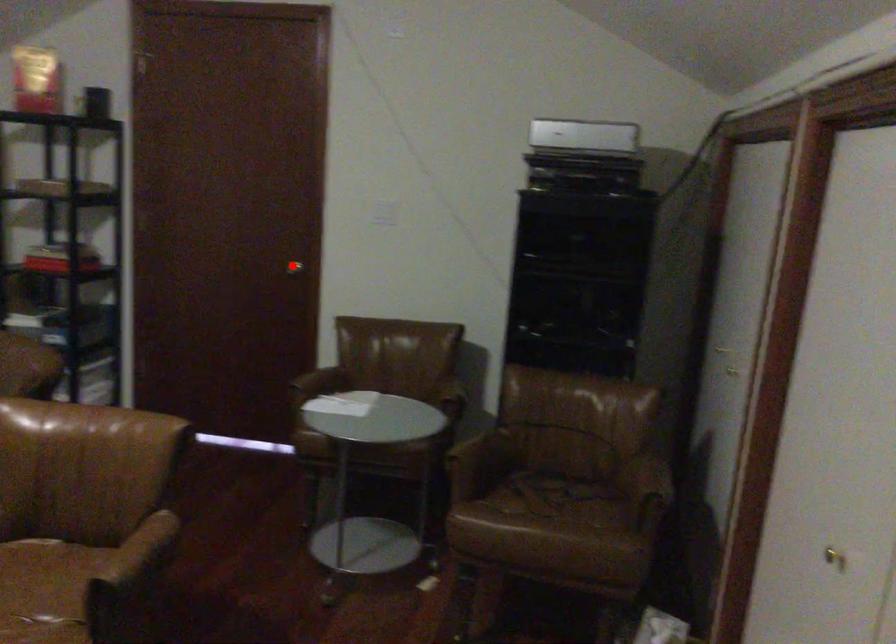
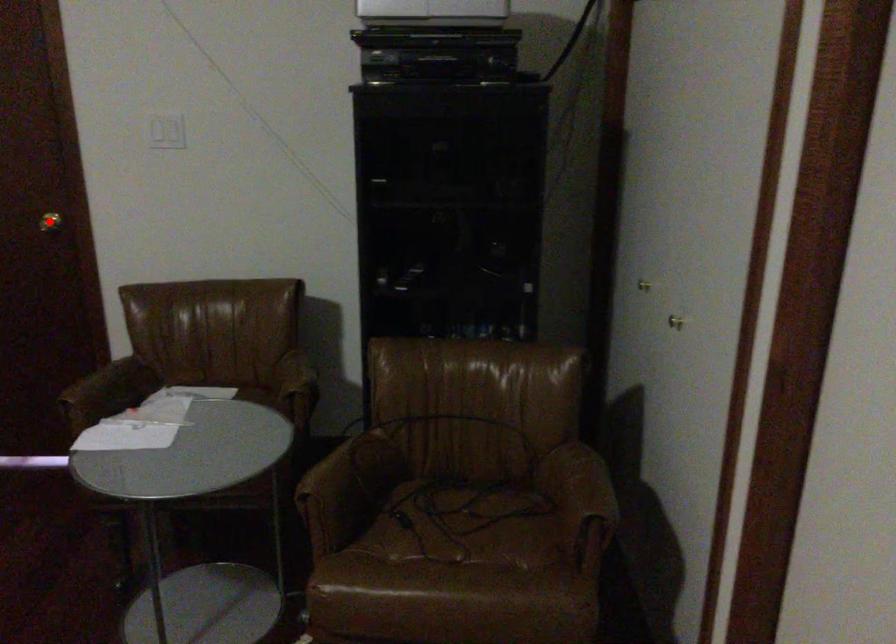
I am providing you with two images of the same scene from different viewpoints. A red point is marked on the first image and another point is marked on the second image. Does the point marked in image1 correspond to the same location as the one in image2?

Yes